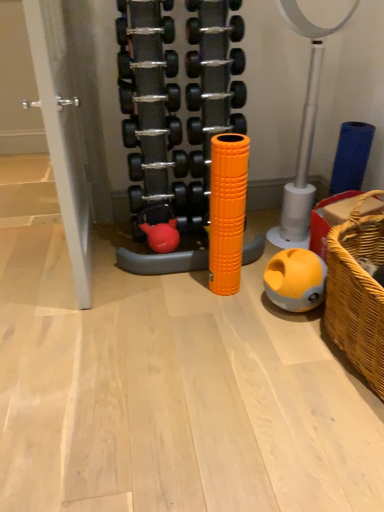
Question: Considering the relative sizes of rubberized red dumbbell at center, placed as the 2th toy when sorted from top to bottom, and orange rubber foam roller at center, which is the 1th toy in top-to-bottom order, in the image provided, is rubberized red dumbbell at center, placed as the 2th toy when sorted from top to bottom, bigger than orange rubber foam roller at center, which is the 1th toy in top-to-bottom order,?

Choices:
 (A) yes
 (B) no

Answer: (B)

Question: Considering the relative sizes of rubberized red dumbbell at center, which ranks as the 2th toy in bottom-to-top order, and orange rubber foam roller at center, the third toy in the bottom-to-top sequence, in the image provided, is rubberized red dumbbell at center, which ranks as the 2th toy in bottom-to-top order, shorter than orange rubber foam roller at center, the third toy in the bottom-to-top sequence,?

Choices:
 (A) no
 (B) yes

Answer: (B)

Question: Is rubberized red dumbbell at center, which ranks as the 2th toy in bottom-to-top order, far from orange rubber foam roller at center, the third toy in the bottom-to-top sequence?

Choices:
 (A) no
 (B) yes

Answer: (A)

Question: Is rubberized red dumbbell at center, placed as the 2th toy when sorted from top to bottom, not within orange rubber foam roller at center, the third toy in the bottom-to-top sequence?

Choices:
 (A) yes
 (B) no

Answer: (B)

Question: Can you confirm if rubberized red dumbbell at center, placed as the 2th toy when sorted from top to bottom, is taller than orange rubber foam roller at center, which is the 1th toy in top-to-bottom order?

Choices:
 (A) no
 (B) yes

Answer: (A)

Question: Considering the positions of point click(x=155, y=215) and point click(x=193, y=91), is point click(x=155, y=215) closer or farther from the camera than point click(x=193, y=91)?

Choices:
 (A) closer
 (B) farther

Answer: (B)

Question: Relative to orange rubber foam roller at center, the third toy in the bottom-to-top sequence, is rubberized red dumbbell at center, placed as the 2th toy when sorted from top to bottom, in front or behind?

Choices:
 (A) behind
 (B) front

Answer: (A)

Question: Do you think rubberized red dumbbell at center, placed as the 2th toy when sorted from top to bottom, is within orange rubber foam roller at center, the third toy in the bottom-to-top sequence, or outside of it?

Choices:
 (A) outside
 (B) inside

Answer: (B)

Question: From a real-world perspective, is rubberized red dumbbell at center, which ranks as the 2th toy in bottom-to-top order, positioned above or below orange rubber foam roller at center, which is the 1th toy in top-to-bottom order?

Choices:
 (A) below
 (B) above

Answer: (A)

Question: Would you say orange rubber foam roller at center, which is the 1th toy in top-to-bottom order, is to the left or to the right of rubberized red dumbbell at center, which ranks as the 2th toy in bottom-to-top order, in the picture?

Choices:
 (A) right
 (B) left

Answer: (A)

Question: From a real-world perspective, is orange rubber foam roller at center, the third toy in the bottom-to-top sequence, physically located above or below rubberized red dumbbell at center, which ranks as the 2th toy in bottom-to-top order?

Choices:
 (A) above
 (B) below

Answer: (A)

Question: In the image, is orange rubber foam roller at center, the third toy in the bottom-to-top sequence, positioned in front of or behind rubberized red dumbbell at center, which ranks as the 2th toy in bottom-to-top order?

Choices:
 (A) front
 (B) behind

Answer: (A)

Question: From the image's perspective, is orange rubber foam roller at center, the third toy in the bottom-to-top sequence, above or below rubberized red dumbbell at center, which ranks as the 2th toy in bottom-to-top order?

Choices:
 (A) below
 (B) above

Answer: (B)

Question: Is yellow matte ball at lower right, positioned as the third toy in top-to-bottom order, situated inside orange rubber foam roller at center, which is the 1th toy in top-to-bottom order, or outside?

Choices:
 (A) outside
 (B) inside

Answer: (A)

Question: From the image's perspective, relative to orange rubber foam roller at center, the third toy in the bottom-to-top sequence, is yellow matte ball at lower right, positioned as the third toy in top-to-bottom order, above or below?

Choices:
 (A) above
 (B) below

Answer: (B)